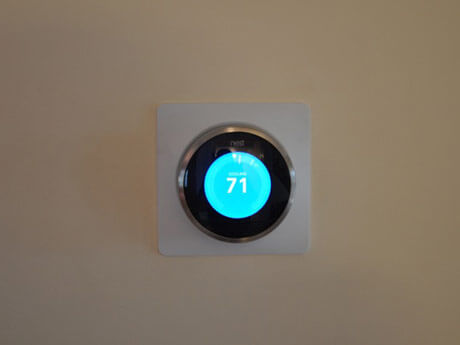
Image resolution: width=460 pixels, height=345 pixels. Identify the location of thermostat. (184, 136).